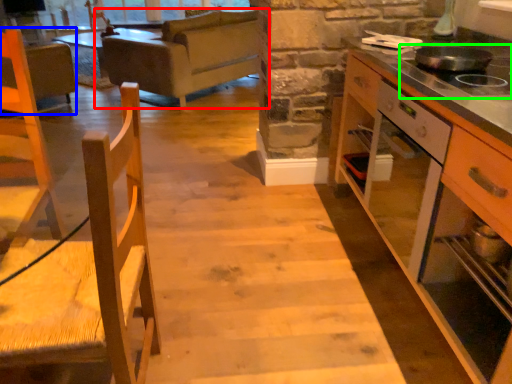
Question: Based on their relative distances, which object is farther from studio couch (highlighted by a red box)? Choose from armchair (highlighted by a blue box) and gas stove (highlighted by a green box).

Choices:
 (A) armchair
 (B) gas stove

Answer: (B)